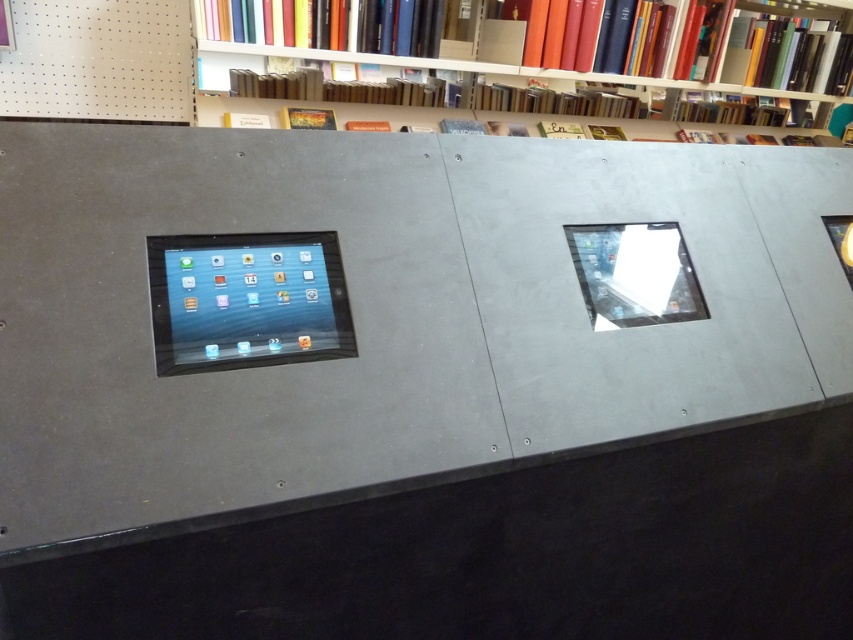
You are standing in the library and need to locate the matte black tablet at left. According to the coordinates provided, where exactly should you look?

The matte black tablet at left is located at point coordinates (247, 300).

You are a customer in the library and want to use the tablet that is turned on. The tablets are located at coordinates point (247, 300) and point 0.530, 0.310. Which coordinate should you go to?

The point (247, 300) corresponds to the matte black tablet at left, which is the one turned on.

You are designing a layout for a library display. You have a matte gray bookcase at upper center and a matte black tablet at left. Which object has a greater width?

The matte gray bookcase at upper center has a greater width than the matte black tablet at left.